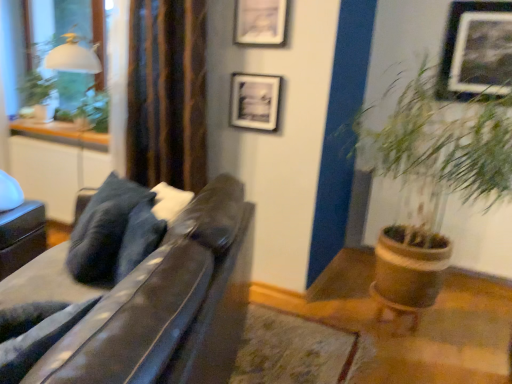
Identify the location of free space above white glossy table at left (from a real-world perspective). (64, 141).